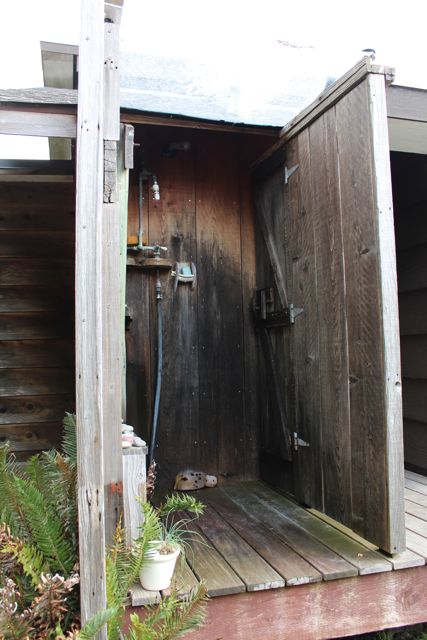
Where is `pot`? This screenshot has width=427, height=640. pot is located at coordinates pos(161,572).